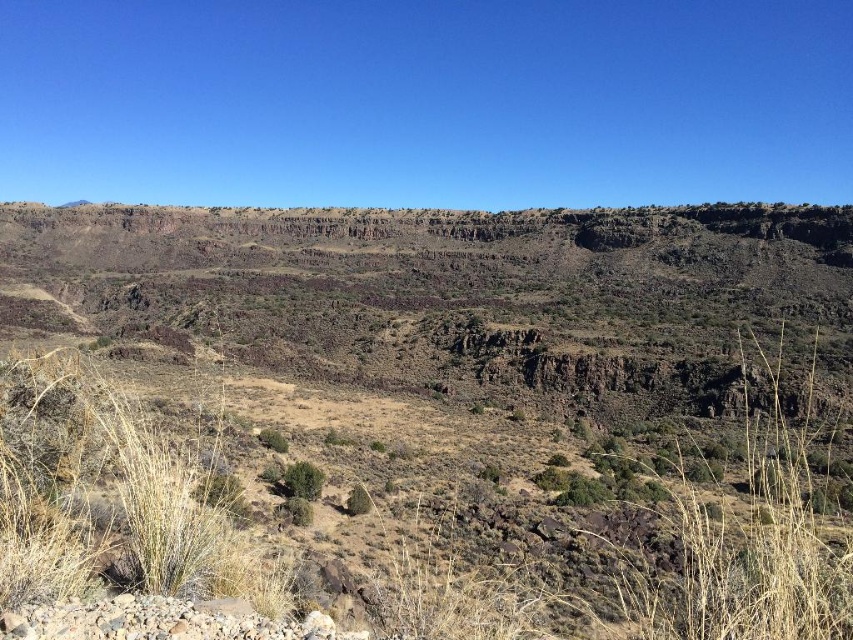
Can you confirm if brown rocky cliffs at upper center is smaller than green leafy bush at center?

Actually, brown rocky cliffs at upper center might be larger than green leafy bush at center.

Where is `brown rocky cliffs at upper center`? The height and width of the screenshot is (640, 853). brown rocky cliffs at upper center is located at coordinates (492, 308).